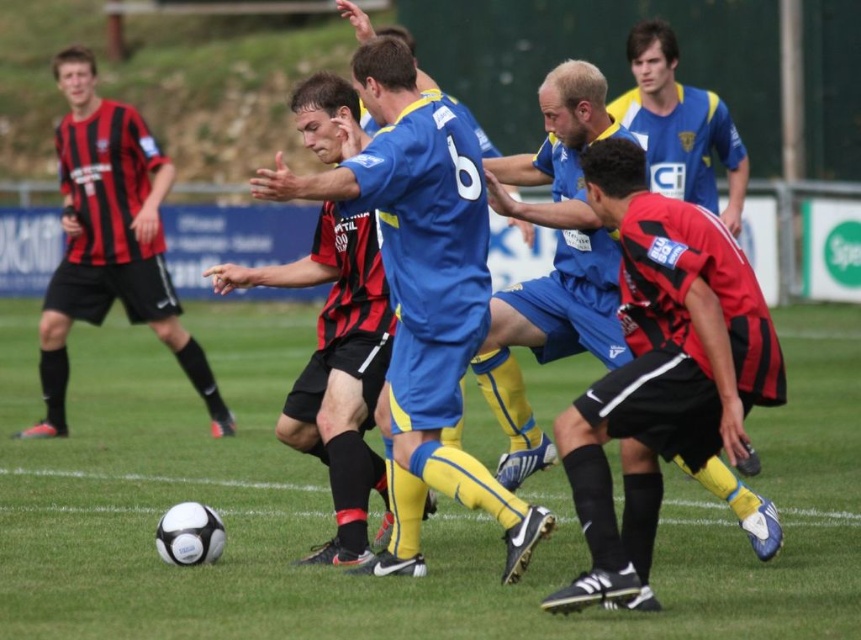
Which is more to the right, red and black jersey at center or blue jersey at center?

Positioned to the right is red and black jersey at center.

The width and height of the screenshot is (861, 640). I want to click on red and black jersey at center, so click(x=661, y=371).

Where is `red and black jersey at center`? Image resolution: width=861 pixels, height=640 pixels. red and black jersey at center is located at coordinates (661, 371).

Does red and black jersey at center appear under black jersey at left?

Yes.

Between red and black jersey at center and black jersey at left, which one appears on the left side from the viewer's perspective?

Positioned to the left is black jersey at left.

Is point (739, 417) in front of point (158, 237)?

That is True.

Where is `red and black jersey at center`? The width and height of the screenshot is (861, 640). red and black jersey at center is located at coordinates (661, 371).

Which is behind, point (45, 604) or point (503, 179)?

Positioned behind is point (503, 179).

What do you see at coordinates (422, 524) in the screenshot? The image size is (861, 640). I see `white matte soccer ball at center` at bounding box center [422, 524].

You are a GUI agent. You are given a task and a screenshot of the screen. Output one action in this format:
    pyautogui.click(x=<x>, y=<y>)
    Task: Click on the white matte soccer ball at center
    
    Given the screenshot: What is the action you would take?
    pyautogui.click(x=422, y=524)